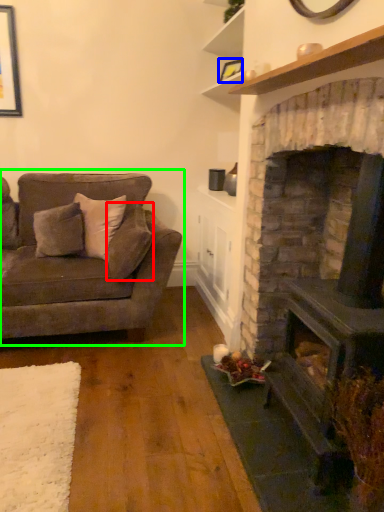
Question: Which object is positioned farthest from pillow (highlighted by a red box)? Select from picture frame (highlighted by a blue box) and studio couch (highlighted by a green box).

Choices:
 (A) picture frame
 (B) studio couch

Answer: (A)